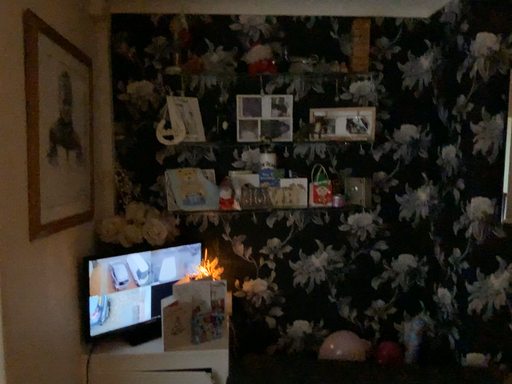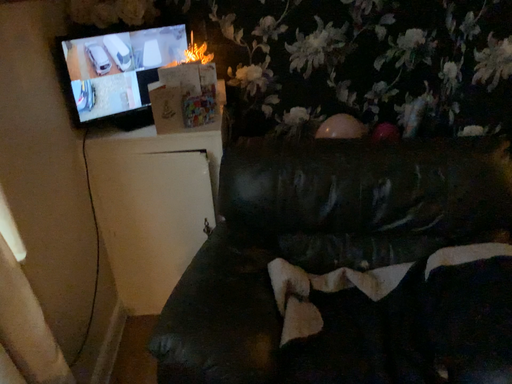
Question: How did the camera likely rotate when shooting the video?

Choices:
 (A) rotated upward
 (B) rotated downward

Answer: (B)